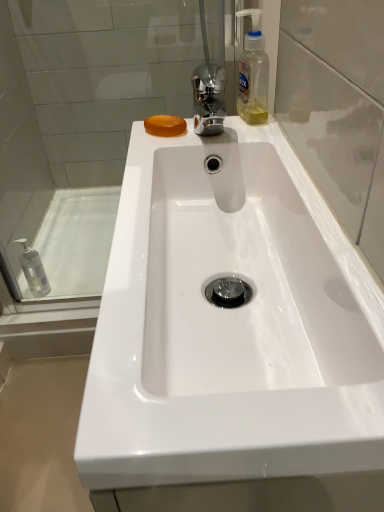
What are the coordinates of `space that is in front of orange translucent soap at upper left` in the screenshot? It's located at (182, 150).